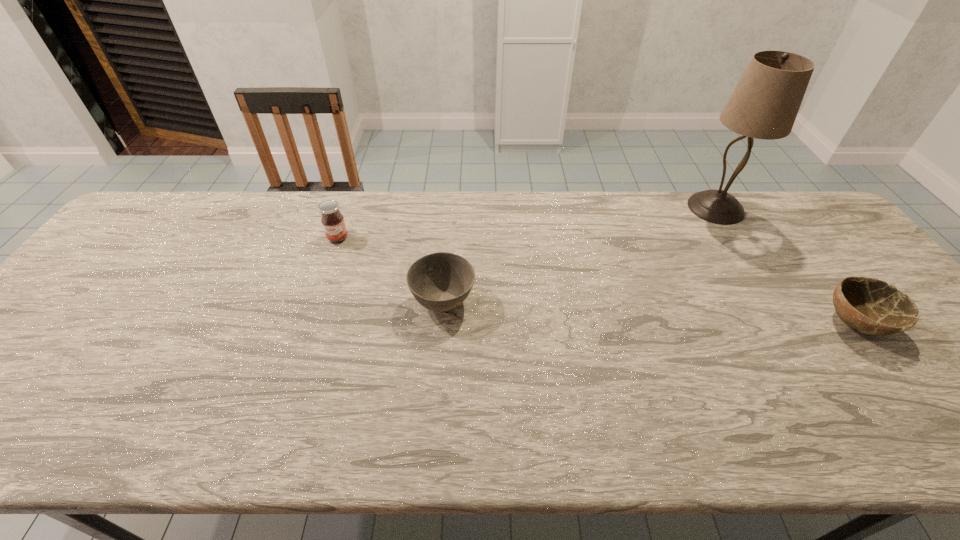
I want to click on free space between the third object from right to left and the third nearest object, so click(391, 269).

This screenshot has height=540, width=960. I want to click on the closest object to the lampshade, so click(871, 306).

Identify the location of object that is the closest one to the left bowl. The width and height of the screenshot is (960, 540). pyautogui.click(x=332, y=220).

Where is `vacant space that satisfies the following two spatial constraints: 1. on the label side of the rightmost object; 2. on the left side of the third shortest object`? vacant space that satisfies the following two spatial constraints: 1. on the label side of the rightmost object; 2. on the left side of the third shortest object is located at coordinates (309, 323).

Locate an element on the screen. Image resolution: width=960 pixels, height=540 pixels. free spot that satisfies the following two spatial constraints: 1. on the front side of the rightmost object; 2. on the left side of the second object from left to right is located at coordinates (442, 323).

The width and height of the screenshot is (960, 540). I want to click on free space in the image that satisfies the following two spatial constraints: 1. on the back side of the right bowl; 2. on the front-facing side of the second object from right to left, so click(x=771, y=208).

This screenshot has width=960, height=540. What are the coordinates of `vacant space that satisfies the following two spatial constraints: 1. on the front-facing side of the lampshade; 2. on the front side of the second object from left to right` in the screenshot? It's located at (772, 301).

This screenshot has height=540, width=960. Identify the location of vacant space that satisfies the following two spatial constraints: 1. on the front-facing side of the rightmost object; 2. on the left side of the tallest object. (785, 323).

Identify the location of vacant region that satisfies the following two spatial constraints: 1. on the front-facing side of the lampshade; 2. on the front side of the second object from left to right. (772, 301).